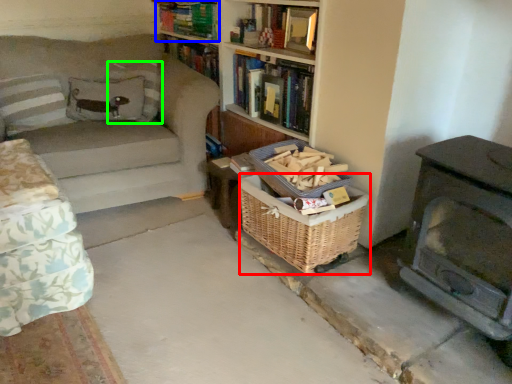
Question: Which object is the closest to the basket (highlighted by a red box)? Choose among these: book (highlighted by a blue box) or pillow (highlighted by a green box).

Choices:
 (A) book
 (B) pillow

Answer: (B)